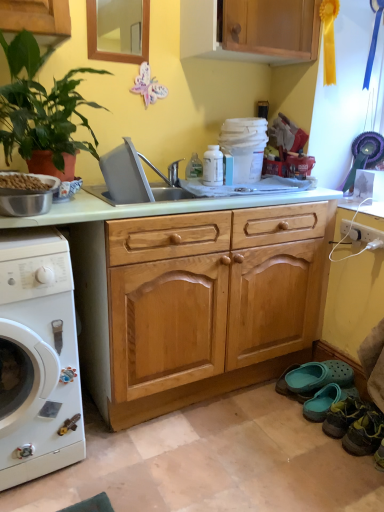
Question: Should I look upward or downward to see leather shoe at lower right, which is the second shoe from front to back?

Choices:
 (A) up
 (B) down

Answer: (B)

Question: Does teal rubber clog at lower right, the 1th shoe positioned from the back, have a larger size compared to leather shoe at lower right, which is the second shoe from front to back?

Choices:
 (A) yes
 (B) no

Answer: (B)

Question: Is teal rubber clog at lower right, which is the 4th shoe in front-to-back order, facing towards leather shoe at lower right, which is the second shoe from front to back?

Choices:
 (A) yes
 (B) no

Answer: (B)

Question: Can you confirm if teal rubber clog at lower right, which is the 4th shoe in front-to-back order, is shorter than leather shoe at lower right, placed as the third shoe when sorted from back to front?

Choices:
 (A) no
 (B) yes

Answer: (B)

Question: Is teal rubber clog at lower right, the 1th shoe positioned from the back, thinner than leather shoe at lower right, which is the second shoe from front to back?

Choices:
 (A) no
 (B) yes

Answer: (A)

Question: From the image's perspective, is teal rubber clog at lower right, which is the 4th shoe in front-to-back order, on top of leather shoe at lower right, which is the second shoe from front to back?

Choices:
 (A) yes
 (B) no

Answer: (A)

Question: Is leather shoe at lower right, which is the second shoe from front to back, at the back of teal rubber clog at lower right, the 1th shoe positioned from the back?

Choices:
 (A) no
 (B) yes

Answer: (A)

Question: Does teal rubber clog at lower right, the 2th shoe when ordered from back to front, appear on the right side of wooden cabinet at upper center?

Choices:
 (A) no
 (B) yes

Answer: (B)

Question: Is wooden cabinet at upper center a part of teal rubber clog at lower right, arranged as the third shoe when viewed from the front?

Choices:
 (A) no
 (B) yes

Answer: (A)

Question: Is teal rubber clog at lower right, the 2th shoe when ordered from back to front, not inside wooden cabinet at upper center?

Choices:
 (A) no
 (B) yes

Answer: (B)

Question: From the image's perspective, is teal rubber clog at lower right, arranged as the third shoe when viewed from the front, on wooden cabinet at upper center?

Choices:
 (A) no
 (B) yes

Answer: (A)

Question: From a real-world perspective, does teal rubber clog at lower right, the 2th shoe when ordered from back to front, stand above wooden cabinet at upper center?

Choices:
 (A) yes
 (B) no

Answer: (B)

Question: From a real-world perspective, is teal rubber clog at lower right, the 2th shoe when ordered from back to front, located beneath wooden cabinet at upper center?

Choices:
 (A) no
 (B) yes

Answer: (B)

Question: Is leather shoe at lower right, placed as the third shoe when sorted from back to front, positioned beyond the bounds of leather shoe at lower right, placed as the first shoe when sorted from front to back?

Choices:
 (A) yes
 (B) no

Answer: (A)